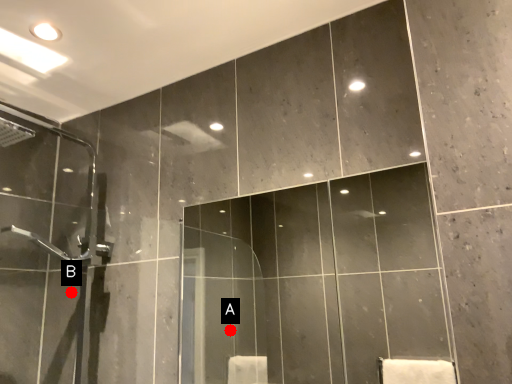
Question: Two points are circled on the image, labeled by A and B beside each circle. Which point is closer to the camera?

Choices:
 (A) A is closer
 (B) B is closer

Answer: (B)